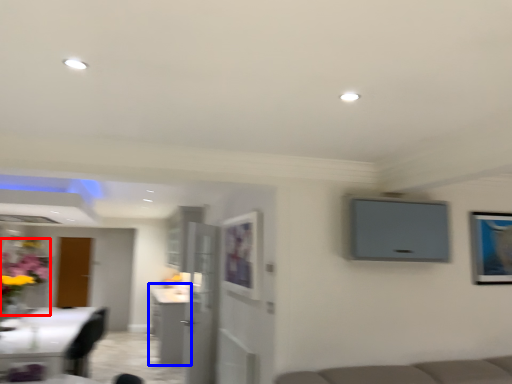
Question: Which object is closer to the camera taking this photo, floral arrangement (highlighted by a red box) or cabinetry (highlighted by a blue box)?

Choices:
 (A) floral arrangement
 (B) cabinetry

Answer: (A)